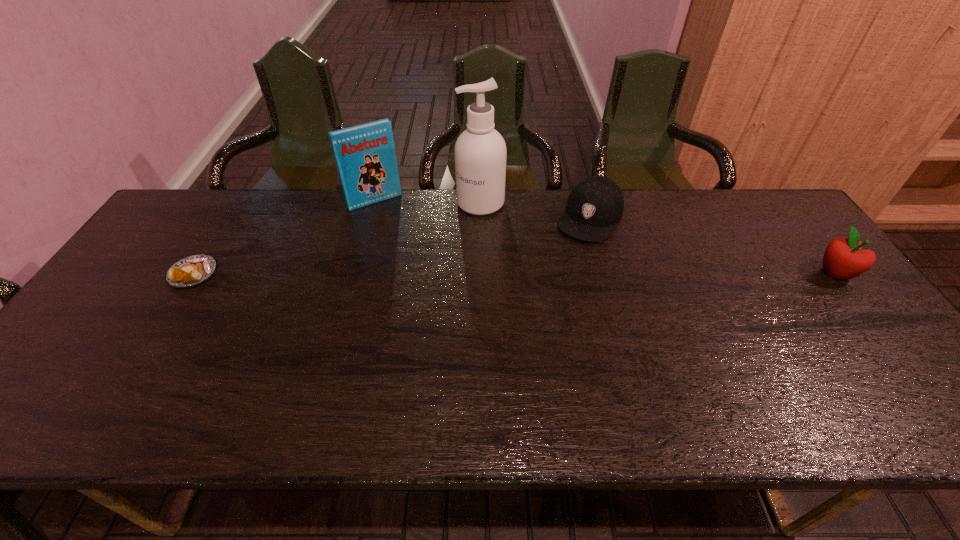
This screenshot has width=960, height=540. What are the coordinates of `book that is positioned at the far edge` in the screenshot? It's located at (365, 156).

Find the location of a particular element. This screenshot has height=540, width=960. object that is at the left edge is located at coordinates pyautogui.click(x=192, y=270).

Identify the location of object located in the right edge section of the desktop. (843, 258).

The height and width of the screenshot is (540, 960). I want to click on vacant area at the far edge of the desktop, so click(x=680, y=200).

This screenshot has width=960, height=540. I want to click on vacant space at the near edge of the desktop, so click(732, 361).

This screenshot has width=960, height=540. I want to click on free space at the left edge, so click(157, 306).

The height and width of the screenshot is (540, 960). Identify the location of vacant space at the right edge of the desktop. (816, 282).

I want to click on vacant space at the far left corner of the desktop, so click(x=164, y=228).

The image size is (960, 540). I want to click on vacant space at the near left corner, so click(47, 386).

In order to click on vacant space in between the cap and the cleansing agent in this screenshot , I will do coord(536,210).